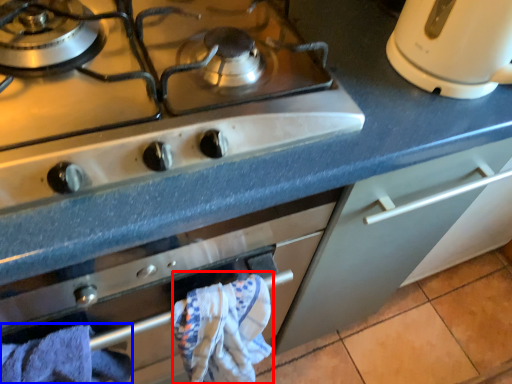
Question: Among these objects, which one is nearest to the camera, bath towel (highlighted by a red box) or bath towel (highlighted by a blue box)?

Choices:
 (A) bath towel
 (B) bath towel

Answer: (B)